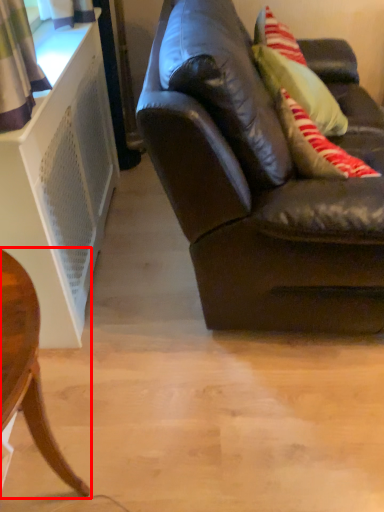
Question: In this image, where is chair (annotated by the red box) located relative to studio couch?

Choices:
 (A) left
 (B) right

Answer: (A)